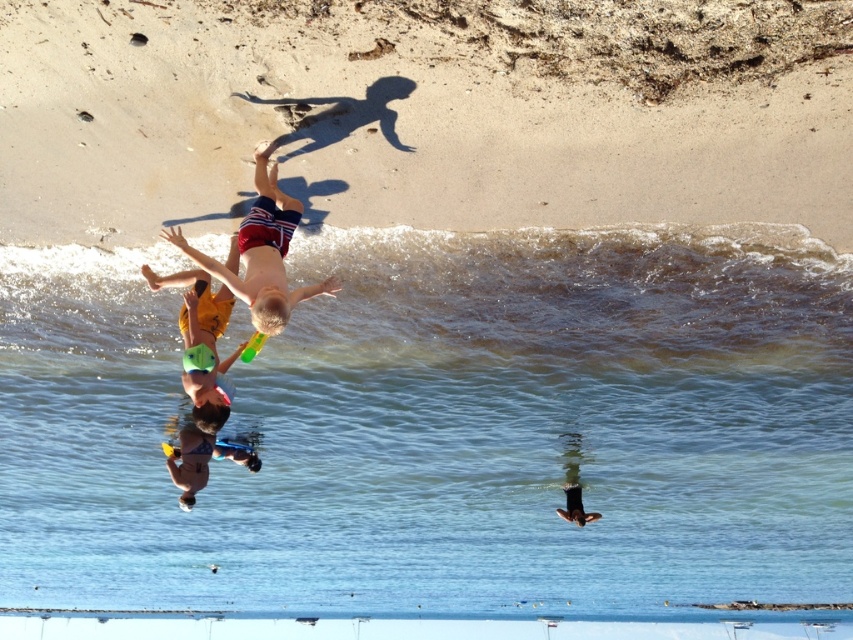
Question: Is beige sand at upper center bigger than blue swimsuit boy at center?

Choices:
 (A) no
 (B) yes

Answer: (B)

Question: Which of the following is the closest to the observer?

Choices:
 (A) beige sand at upper center
 (B) red and white striped shorts at center
 (C) clear water at wave upper

Answer: (A)

Question: Can you confirm if clear blue water at center is wider than blue swimsuit boy at center?

Choices:
 (A) no
 (B) yes

Answer: (B)

Question: Estimate the real-world distances between objects in this image. Which object is farther from the clear water at wave upper?

Choices:
 (A) red and white striped shorts at center
 (B) clear blue water at center

Answer: (B)

Question: Which point is closer to the camera?

Choices:
 (A) (735, 276)
 (B) (416, 406)
 (C) (187, 483)
 (D) (126, 45)

Answer: (D)

Question: Does beige sand at upper center have a smaller size compared to red and white striped shorts at center?

Choices:
 (A) no
 (B) yes

Answer: (A)